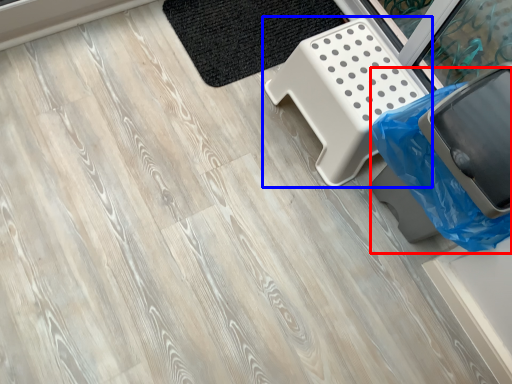
Question: Among these objects, which one is farthest to the camera, garbage (highlighted by a red box) or furniture (highlighted by a blue box)?

Choices:
 (A) garbage
 (B) furniture

Answer: (B)